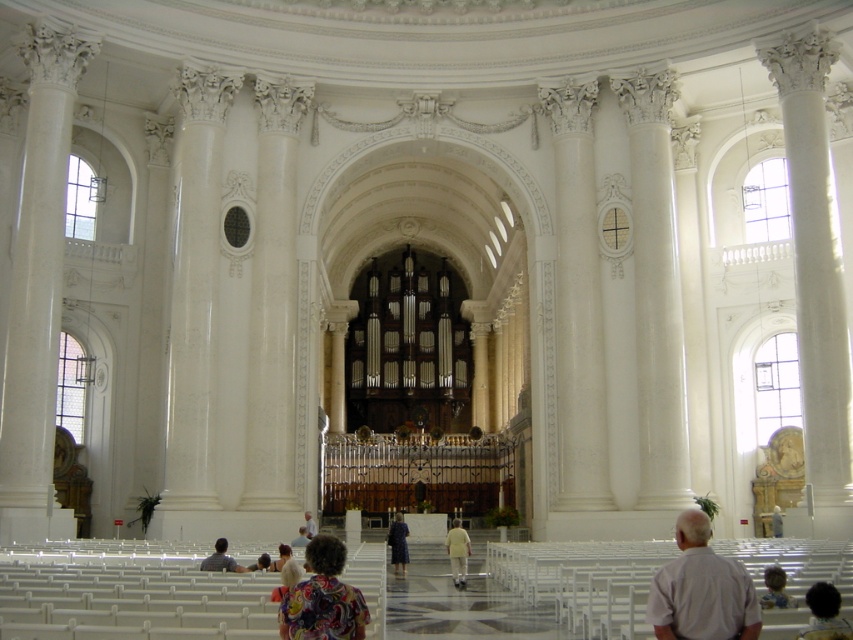
Question: Is floral shirt at lower center to the left of dark gray shirt at lower left from the viewer's perspective?

Choices:
 (A) yes
 (B) no

Answer: (B)

Question: Estimate the real-world distances between objects in this image. Which object is farther from the light brown hair at center?

Choices:
 (A) floral shirt at lower center
 (B) dark blue fabric coat at center
 (C) white matte shirt at lower right
 (D) light brown leather jacket at lower right

Answer: (D)

Question: Which of the following is the farthest from the observer?

Choices:
 (A) (213, 570)
 (B) (280, 572)
 (C) (346, 593)
 (D) (775, 515)

Answer: (D)

Question: Is floral shirt at lower center positioned behind floral shirt at center?

Choices:
 (A) yes
 (B) no

Answer: (B)

Question: Which point is farther from the camera taking this photo?

Choices:
 (A) (456, 580)
 (B) (328, 627)
 (C) (201, 564)

Answer: (A)

Question: Is light brown hair at center thinner than light brown leather jacket at center?

Choices:
 (A) no
 (B) yes

Answer: (A)